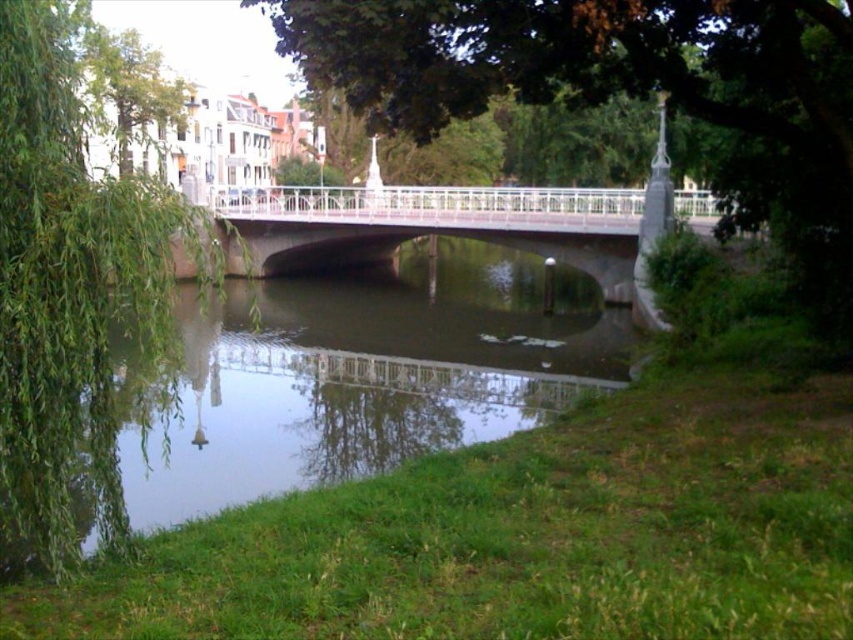
Question: Which point is closer to the camera taking this photo?

Choices:
 (A) (352, 189)
 (B) (294, 20)
 (C) (120, 72)
 (D) (61, 193)

Answer: (D)

Question: Is green grassy river at center to the left of green leafy tree at upper left from the viewer's perspective?

Choices:
 (A) no
 (B) yes

Answer: (A)

Question: Which object is positioned farthest from the green grassy river at center?

Choices:
 (A) green leafy tree at upper left
 (B) green leafy willow at left
 (C) white metallic bridge at center
 (D) green leafy tree at center

Answer: (A)

Question: Is green leafy willow at left further to the viewer compared to green leafy tree at upper left?

Choices:
 (A) yes
 (B) no

Answer: (B)

Question: Can you confirm if green leafy tree at center is positioned to the left of green leafy tree at upper left?

Choices:
 (A) no
 (B) yes

Answer: (A)

Question: Which of the following is the closest to the observer?

Choices:
 (A) (341, 244)
 (B) (164, 80)
 (C) (682, 42)
 (D) (67, 556)

Answer: (D)